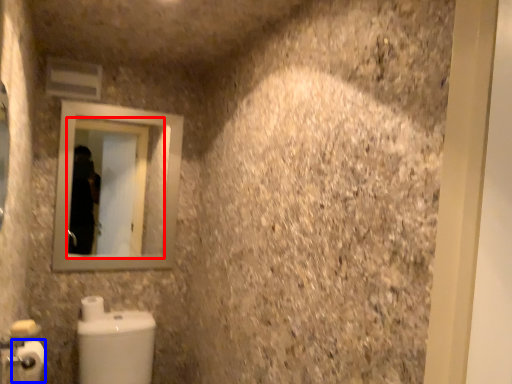
Question: Which point is further to the camera, mirror (highlighted by a red box) or toilet paper (highlighted by a blue box)?

Choices:
 (A) mirror
 (B) toilet paper

Answer: (A)